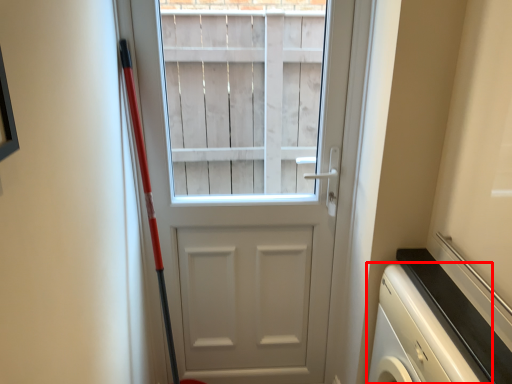
Question: From the image's perspective, where is dish washer (annotated by the red box) located in relation to door in the image?

Choices:
 (A) below
 (B) above

Answer: (A)